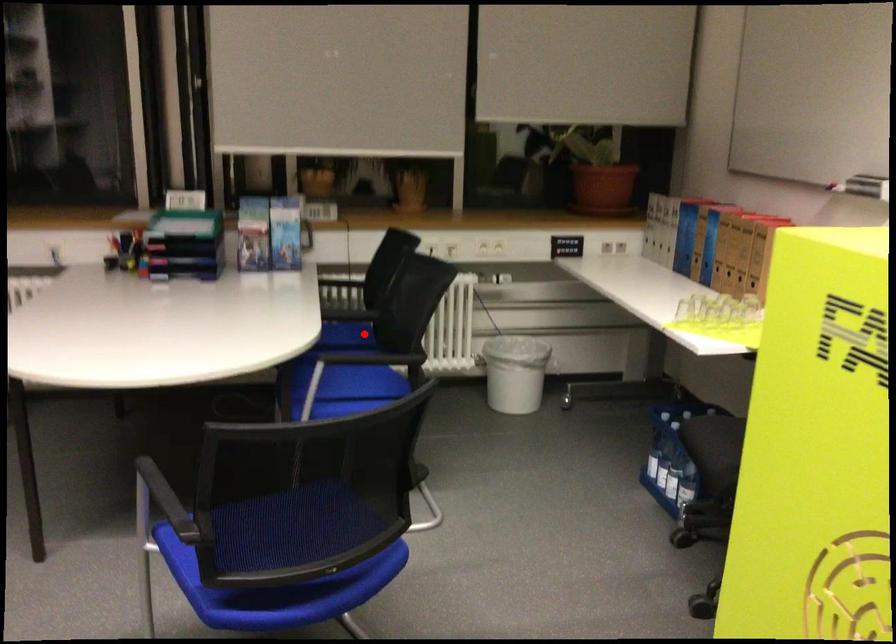
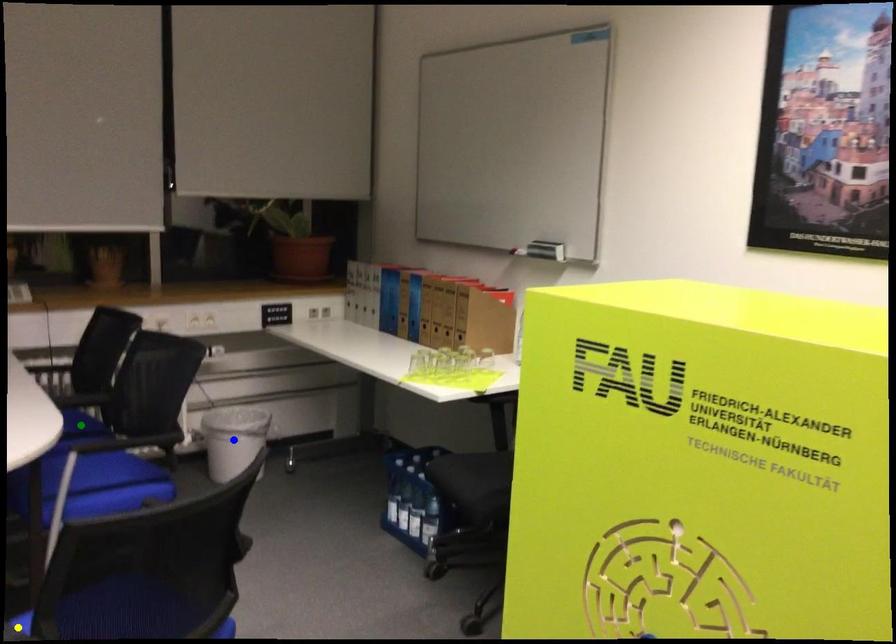
Question: I am providing you with two images of the same scene from different viewpoints. A red point is marked on the first image. You are given multiple points on the second image. Which mark in image 2 goes with the point in image 1?

Choices:
 (A) yellow point
 (B) green point
 (C) blue point

Answer: (B)